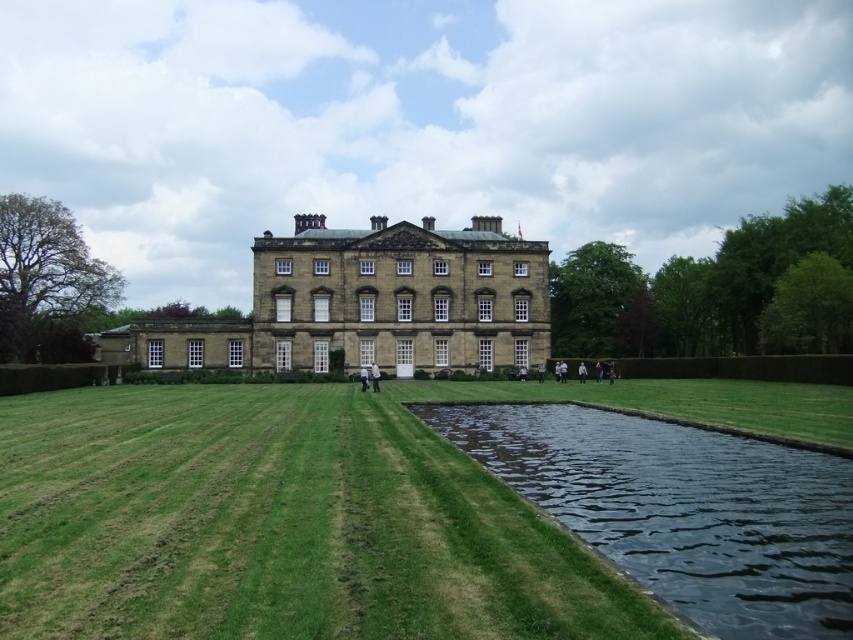
Question: Can you confirm if dark reflective water at lower right is bigger than brown stone mansion at center?

Choices:
 (A) yes
 (B) no

Answer: (B)

Question: Among these points, which one is nearest to the camera?

Choices:
 (A) (384, 602)
 (B) (321, 266)

Answer: (A)

Question: Where is dark reflective water at lower right located in relation to brown stone mansion at center in the image?

Choices:
 (A) left
 (B) right

Answer: (B)

Question: Among these objects, which one is nearest to the camera?

Choices:
 (A) green grass at center
 (B) dark reflective water at lower right

Answer: (A)

Question: Can you confirm if dark reflective water at lower right is positioned below brown stone mansion at center?

Choices:
 (A) yes
 (B) no

Answer: (A)

Question: Based on their relative distances, which object is nearer to the dark reflective water at lower right?

Choices:
 (A) brown stone mansion at center
 (B) green grass at center

Answer: (B)